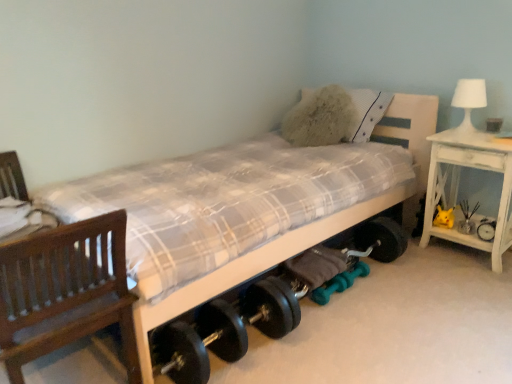
You are a GUI agent. You are given a task and a screenshot of the screen. Output one action in this format:
    pyautogui.click(x=<x>, y=<y>)
    Task: Click on the free space in front of white distressed wood nightstand at right
    This screenshot has width=512, height=384.
    Given the screenshot: What is the action you would take?
    pos(473,287)